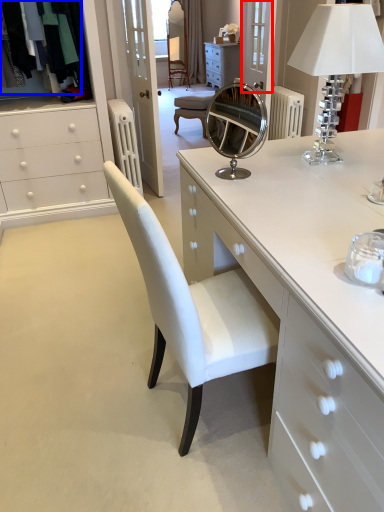
Question: Which object is further to the camera taking this photo, glass door (highlighted by a red box) or clothing (highlighted by a blue box)?

Choices:
 (A) glass door
 (B) clothing

Answer: (A)